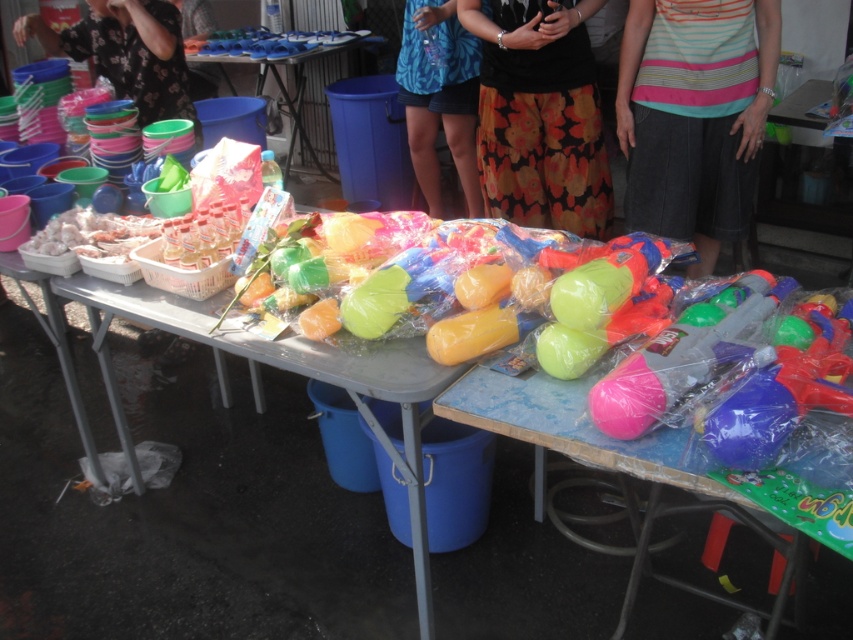
Is striped fabric skirt at center bigger than floral skirt at center?

Incorrect, striped fabric skirt at center is not larger than floral skirt at center.

Which is in front, point (740, 83) or point (518, 102)?

Point (740, 83)

Locate an element on the screen. striped fabric skirt at center is located at coordinates (694, 115).

Is point (577, 188) more distant than point (427, 192)?

No, it is in front of (427, 192).

What do you see at coordinates (538, 115) in the screenshot?
I see `floral skirt at center` at bounding box center [538, 115].

Find the location of a particular element. The height and width of the screenshot is (640, 853). floral skirt at center is located at coordinates (538, 115).

Is point (734, 192) farther from viewer compared to point (532, 492)?

Yes, point (734, 192) is behind point (532, 492).

Who is positioned more to the left, striped fabric skirt at center or translucent plastic toys at center?

translucent plastic toys at center

Measure the distance between striped fabric skirt at center and camera.

They are 6.82 feet apart.

Where is `striped fabric skirt at center`? striped fabric skirt at center is located at coordinates (694, 115).